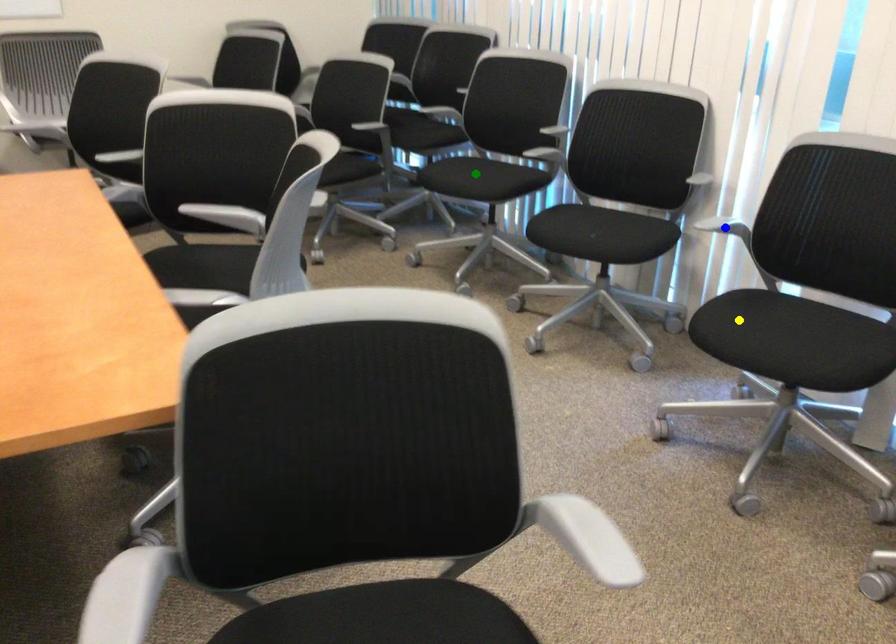
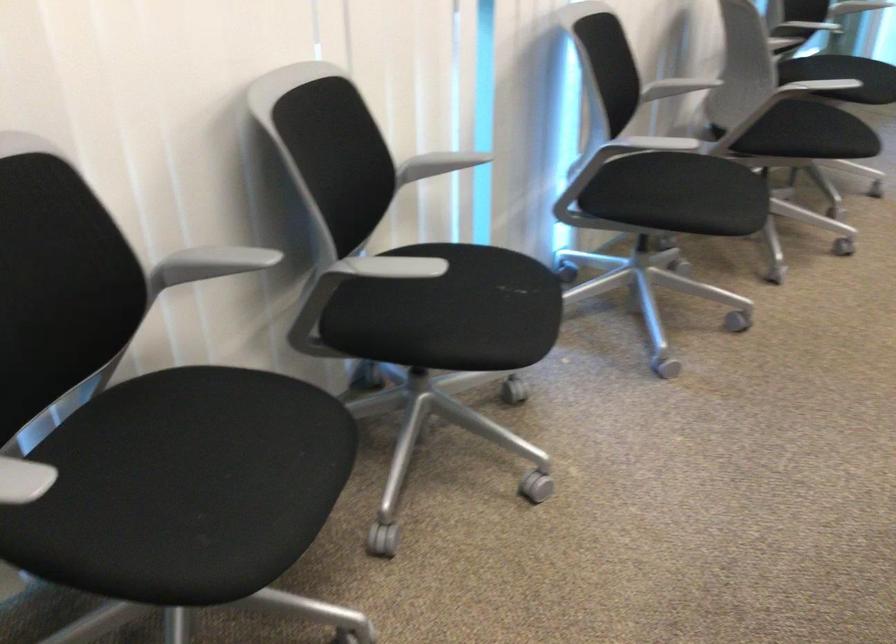
I am providing you with two images of the same scene from different viewpoints. Three points are marked in image1. Which point corresponds to a part or object that is occluded in image2?In image1, three points are marked. Which of them correspond to a part or object that is occluded in image2?Among the three points shown in image1, which one corresponds to a part or object that is no longer visible due to occlusion in image2?

Invisible in image2: blue point.